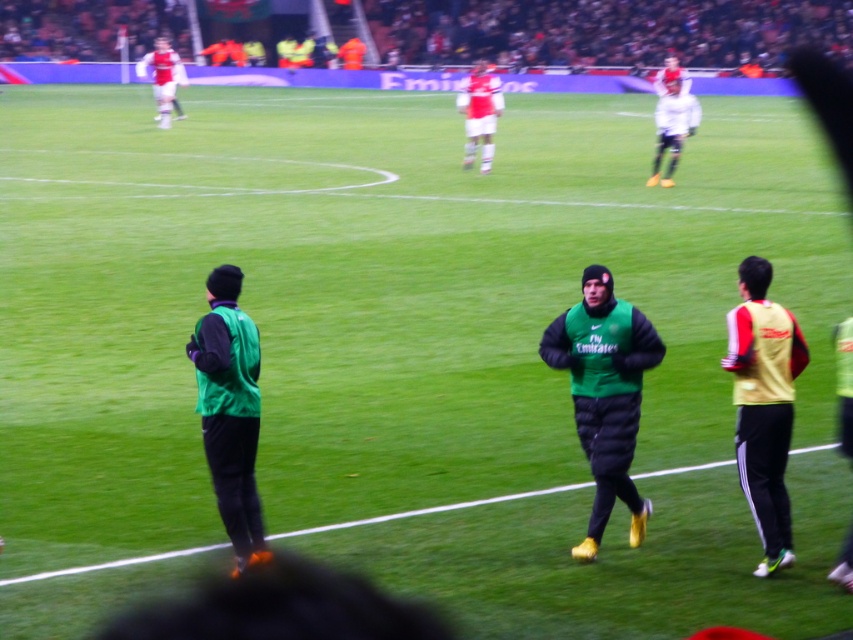
Looking at this image, you are a coach observing a soccer training session. You see the green matte jacket at center and the matte red shorts at center. How far apart are these two items?

The green matte jacket at center is 17.89 meters from the matte red shorts at center.

You are a sports equipment manager observing the soccer field. You need to ensure that all equipment is properly sized. The green matte jacket at center and the matte red shorts at center are both part of the training gear. Which piece of equipment is shorter in height?

The green matte jacket at center is not as tall as the matte red shorts at center, so the green matte jacket at center is shorter in height.

Consider the image. You are a soccer coach observing the training session. You notice two points marked on the field. The first point is at coordinates point (630,532) and the second is at point (485,99). Which point is closer to you as the coach standing at the edge of the field?

Point (630,532) is closer to the viewer than point (485,99), so the first point is closer to you as the coach standing at the edge of the field.